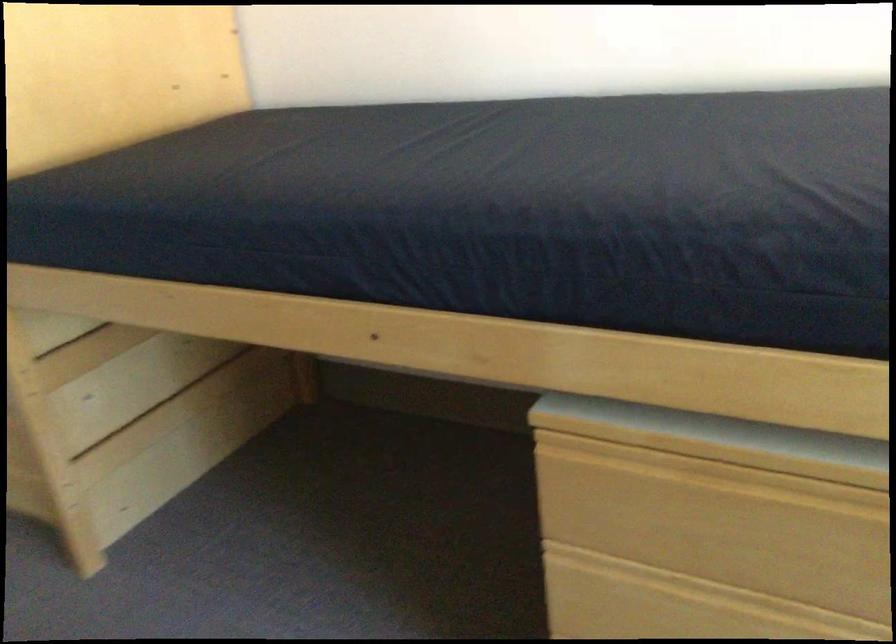
Identify the location of drawer handle groove. (616, 422).